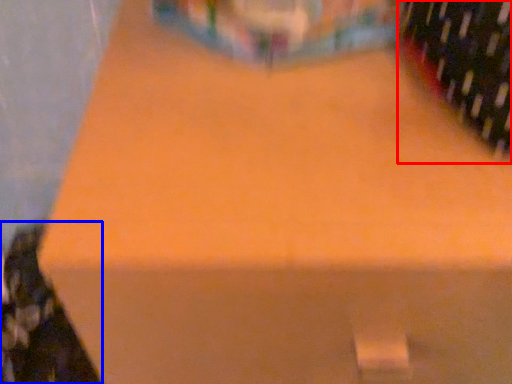
Question: Which object is further to the camera taking this photo, wine bottle (highlighted by a red box) or wine bottle (highlighted by a blue box)?

Choices:
 (A) wine bottle
 (B) wine bottle

Answer: (B)